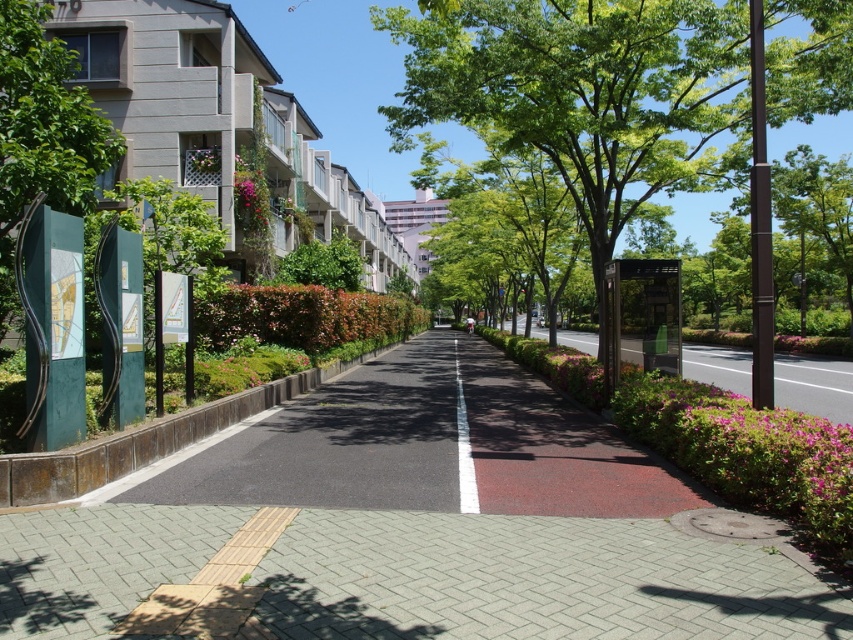
Between red asphalt pavement at center and white smooth line at center, which one is positioned higher?

red asphalt pavement at center

You are a GUI agent. You are given a task and a screenshot of the screen. Output one action in this format:
    pyautogui.click(x=<x>, y=<y>)
    Task: Click on the red asphalt pavement at center
    This screenshot has width=853, height=640.
    Given the screenshot: What is the action you would take?
    pyautogui.click(x=428, y=445)

The height and width of the screenshot is (640, 853). I want to click on red asphalt pavement at center, so click(x=428, y=445).

Image resolution: width=853 pixels, height=640 pixels. I want to click on green leafy tree at center, so click(x=614, y=86).

Who is taller, green leafy tree at center or green leafy tree at left?

With more height is green leafy tree at center.

This screenshot has height=640, width=853. Describe the element at coordinates (614, 86) in the screenshot. I see `green leafy tree at center` at that location.

The width and height of the screenshot is (853, 640). I want to click on green leafy tree at center, so click(614, 86).

Which of these two, smooth asphalt road at center or green leafy tree at center, stands shorter?

smooth asphalt road at center is shorter.

Is smooth asphalt road at center positioned in front of green leafy tree at center?

Yes, it is in front of green leafy tree at center.

Which is in front, point (763, 518) or point (602, 214)?

Point (763, 518)

This screenshot has height=640, width=853. I want to click on smooth asphalt road at center, so click(x=410, y=528).